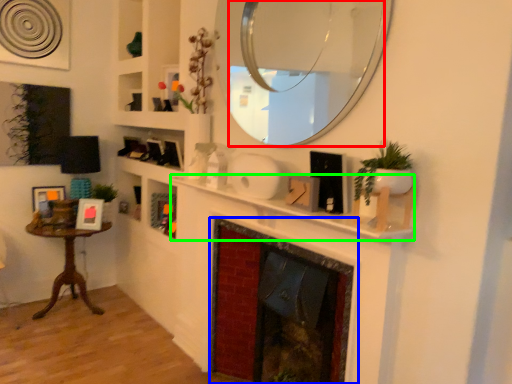
Question: Which object is the closest to the mirror (highlighted by a red box)? Choose among these: fireplace (highlighted by a blue box) or mantle (highlighted by a green box).

Choices:
 (A) fireplace
 (B) mantle

Answer: (B)